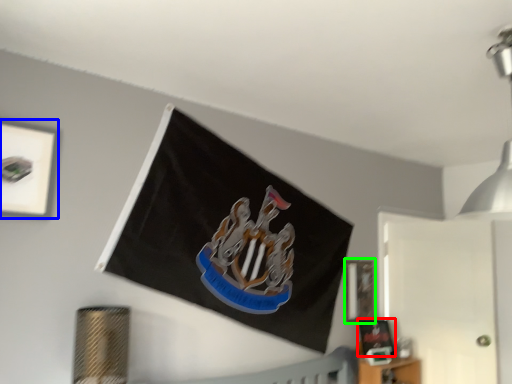
Question: Estimate the real-world distances between objects in this image. Which object is closer to picture frame (highlighted by a red box), picture frame (highlighted by a blue box) or picture frame (highlighted by a green box)?

Choices:
 (A) picture frame
 (B) picture frame

Answer: (B)